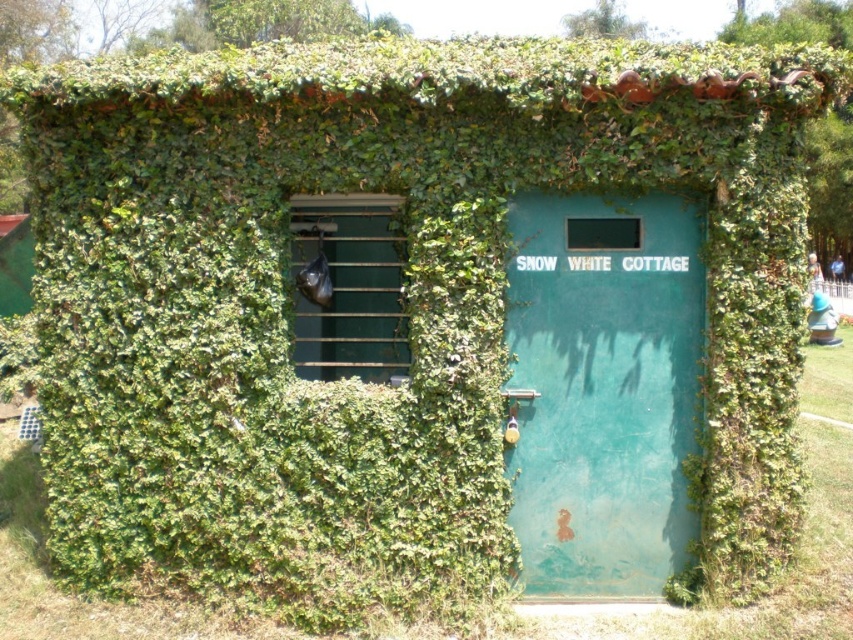
You are standing in front of the Snow White Cottage and notice the green matte door at center and the black plastic bag at center. Which object is positioned higher relative to the other?

The black plastic bag at center is positioned higher than the green matte door at center because the green matte door at center is below the black plastic bag at center.